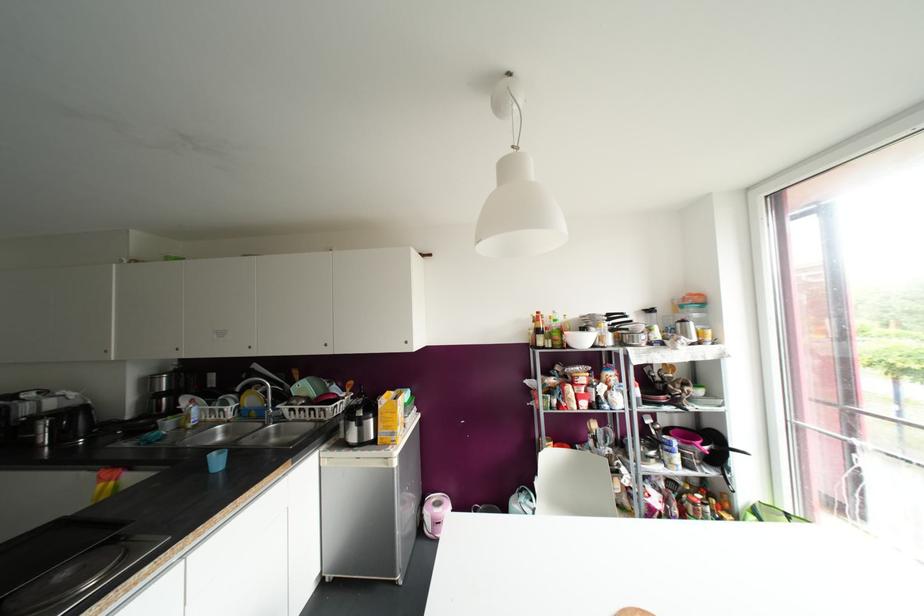
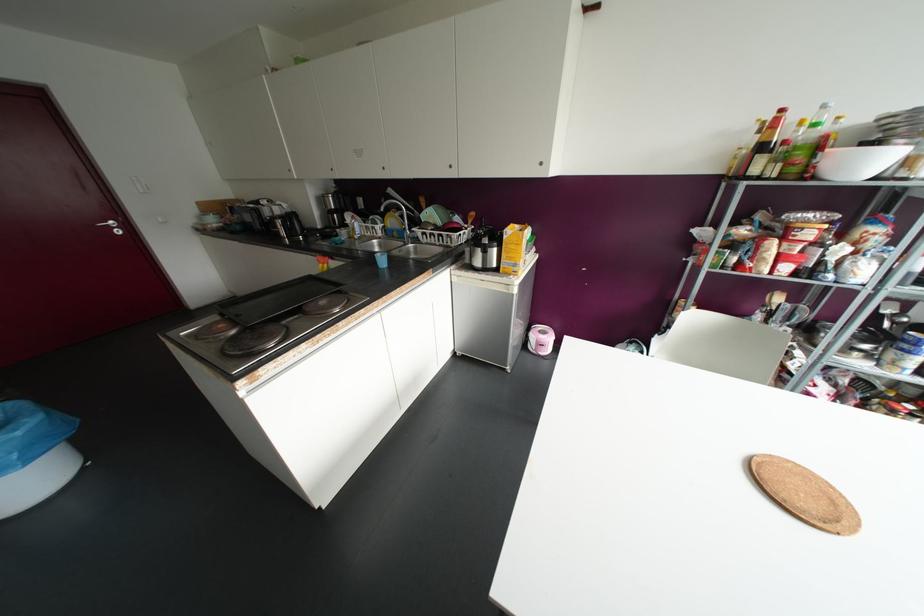
Find the pixel in the second image that matches the point at 283,408 in the first image.

(417, 231)